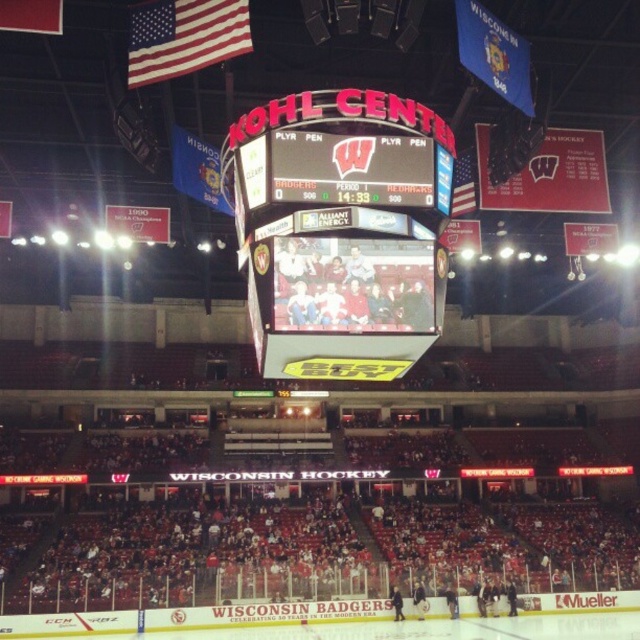
From the picture: You are attending a hockey game at the Kohl Center and want to check the score. Where is the matte digital display at center located in relation to the main scoreboard?

The matte digital display at center is located at point (340, 230) on the scoreboard.

You are standing in the Kohl Center watching a hockey game. You want to check the score but are currently facing away from the matte digital display at center. If you turn around, will you be able to see the scoreboard clearly from your current position?

The distance between you and the matte digital display at center is 22.56 meters. Since this distance is within typical viewing ranges for such large displays, you should be able to see the scoreboard clearly when you turn around.

You are an event photographer at the Kohl Center and need to capture both the matte digital display at center and the american flag at upper left in a single shot. Given that your camera has a fixed focal length, which object should you position closer to the center of your frame to ensure both are in focus?

The matte digital display at center is bigger than the american flag at upper left, so you should position the matte digital display at center closer to the center of your frame to ensure both are in focus.